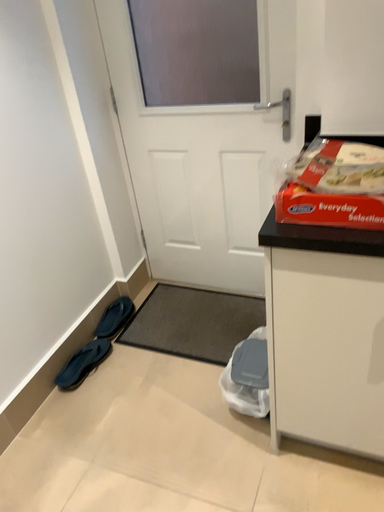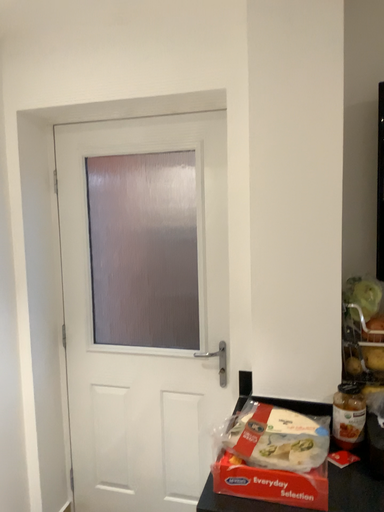
Question: Which way did the camera rotate in the video?

Choices:
 (A) rotated left
 (B) rotated right

Answer: (B)